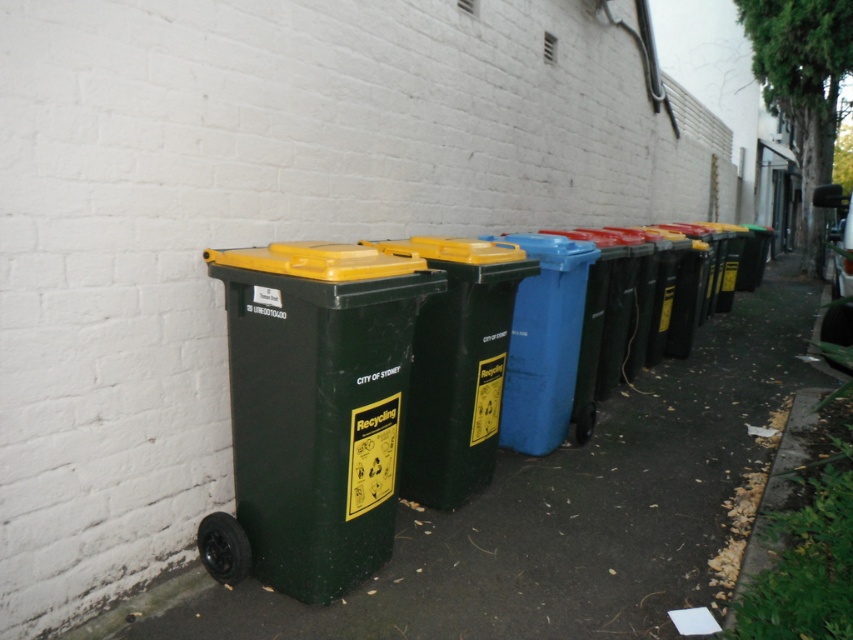
You are a sanitation worker who needs to move the green plastic bin at left and the matte green recycling bin at left to a new location. The path you need to take is narrow, only 30 inches wide. Can both bins fit side by side through the path?

The green plastic bin at left is 32.79 inches from matte green recycling bin at left, which means the combined width of both bins is 32.79 inches. Since the path is only 30 inches wide, the two bins cannot fit side by side through the path.

You are a sanitation worker who needs to place a new recycling bin between the green plastic bin at left and the matte green recycling bin at left. Which bin should you place the new bin closer to if you want it to be the same size as the smaller one?

The green plastic bin at left is smaller than the matte green recycling bin at left, so you should place the new bin closer to the green plastic bin at left to match its size.

You are a sanitation worker who needs to move the matte green recycling bin at left and the green plastic recycling bin at center to a new location. Since both bins have wheels, you can push them. However, you want to keep their original left to right arrangement. Which bin should you push first to maintain their order?

The matte green recycling bin at left is positioned on the left side of the green plastic recycling bin at center. To maintain their original left to right arrangement, you should push the matte green recycling bin at left first, followed by the green plastic recycling bin at center.